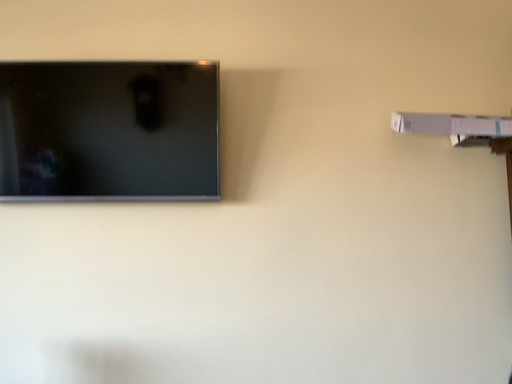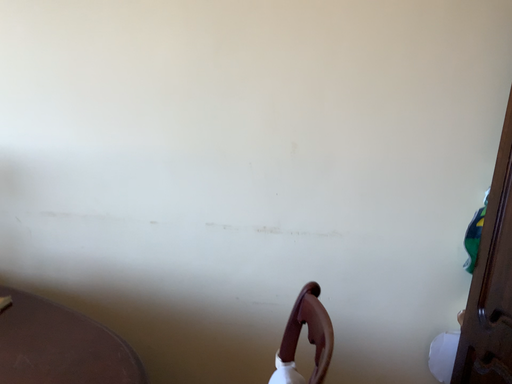
Question: How did the camera likely rotate when shooting the video?

Choices:
 (A) rotated upward
 (B) rotated downward

Answer: (B)